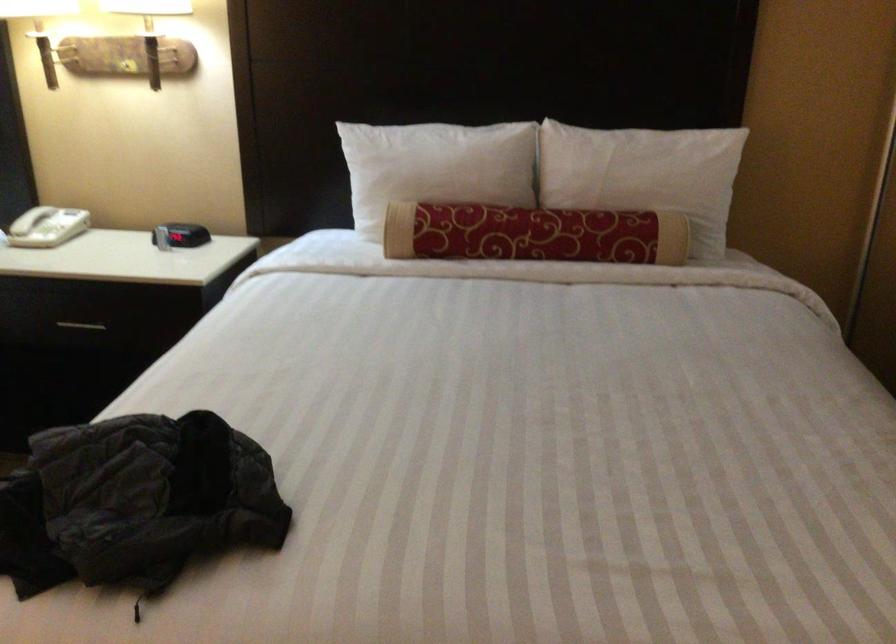
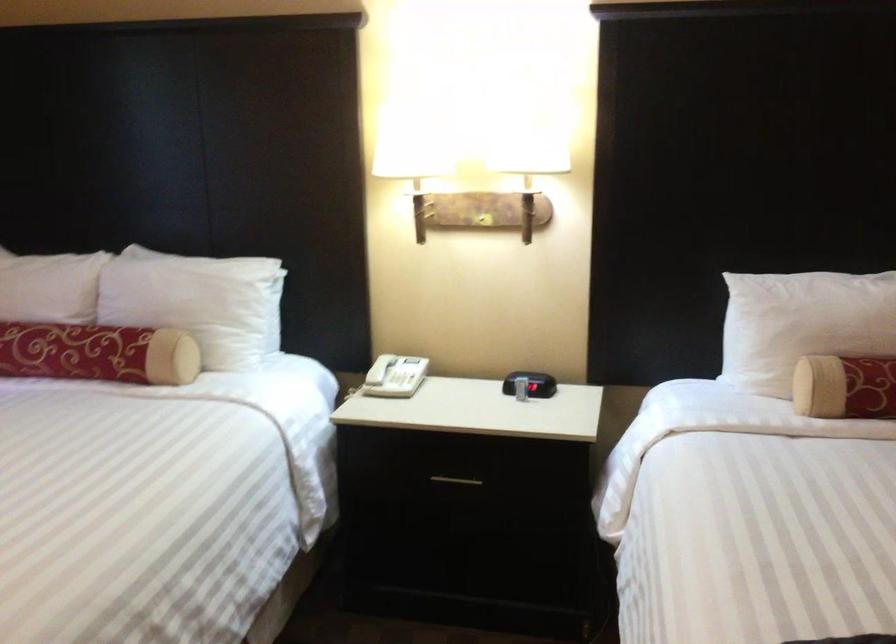
Where in the second image is the point corresponding to pixel 125 69 from the first image?

(483, 220)